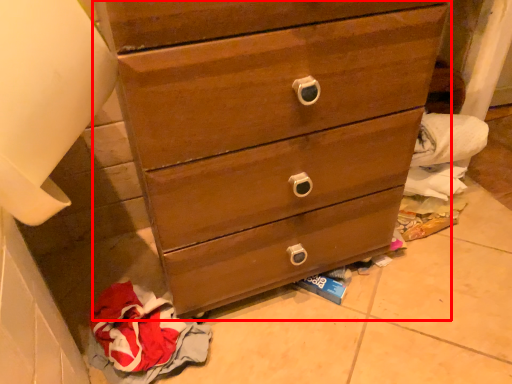
Question: From the image's perspective, what is the correct spatial positioning of chest of drawers (annotated by the red box) in reference to baby clothe?

Choices:
 (A) above
 (B) below

Answer: (A)